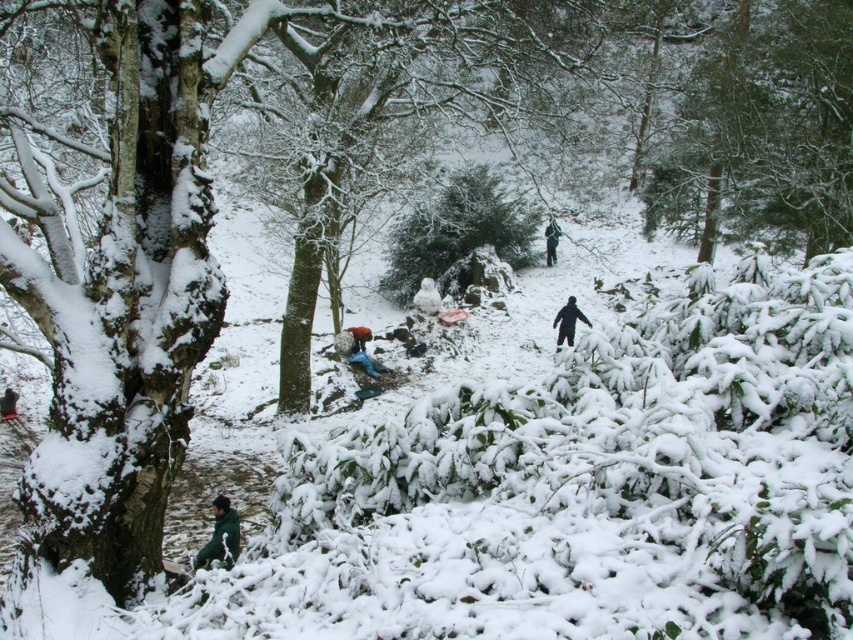
You are a hiker trying to locate two people in the snowy forest. You see a green matte jacket at lower left and a black matte snowsuit at center. Which one is more to the left?

The green matte jacket at lower left is more to the left.

You are standing at the camera position and want to take a photo of the black matte snowsuit at center. Considering the camera has a maximum focus range of 60 feet, will you be able to capture the snowsuit in focus?

The black matte snowsuit at center is 62.89 feet away from the camera, which exceeds the maximum focus range of 60 feet. Therefore, the camera cannot focus on the snowsuit at that distance.

You are standing at the center of the snowy forest scene. There is a point marked at coordinates (567, 321). What object is located exactly at that point?

The black matte snowsuit at center is located exactly at point (567, 321).